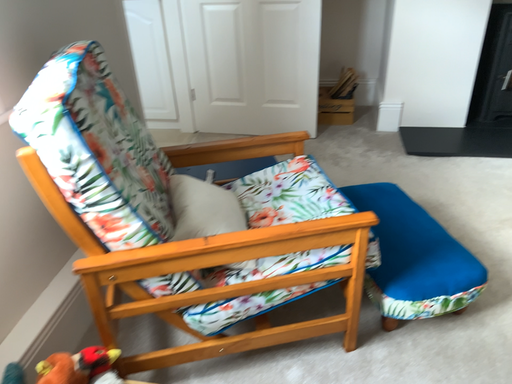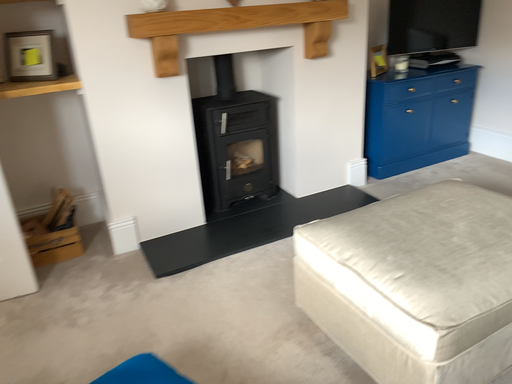
Question: Which way did the camera rotate in the video?

Choices:
 (A) rotated upward
 (B) rotated downward

Answer: (A)